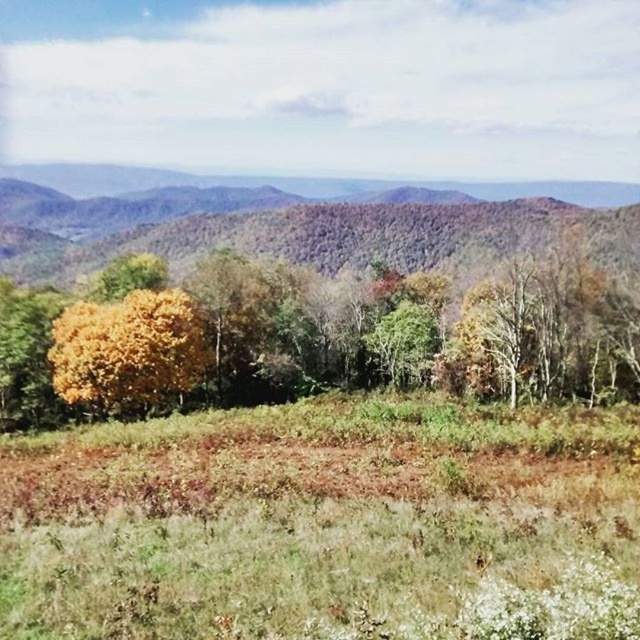
Question: Estimate the real-world distances between objects in this image. Which object is farther from the yellow leafy tree at center?

Choices:
 (A) green leafy forest at upper center
 (B) golden yellow leaves at center

Answer: (A)

Question: Is yellow leafy tree at center wider than golden yellow leaves at center?

Choices:
 (A) yes
 (B) no

Answer: (A)

Question: Which point is closer to the camera?

Choices:
 (A) (400, 403)
 (B) (76, 337)
 (C) (195, 282)
 (D) (72, 182)

Answer: (A)

Question: Is yellow leafy tree at center thinner than golden yellow leaves at center?

Choices:
 (A) yes
 (B) no

Answer: (B)

Question: Which is farther from the green leafy forest at upper center?

Choices:
 (A) yellow leafy tree at center
 (B) brown dry grass at lower center
 (C) golden yellow leaves at center

Answer: (B)

Question: Where is yellow leafy tree at center located in relation to green leafy forest at upper center in the image?

Choices:
 (A) left
 (B) right

Answer: (B)